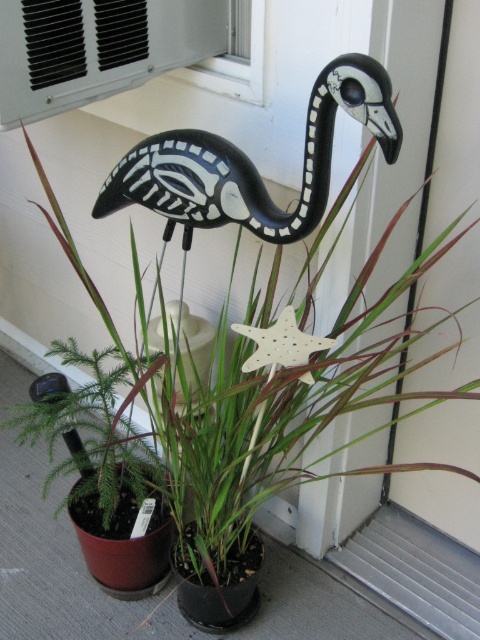
You are standing in the scene and want to place a small statue between the two points, point (105, 52) and point (259, 365). Which point should the statue be closer to in order to be closer to the flamingo?

The statue should be closer to point (259, 365) because it is farther from the viewer than point (105, 52), so placing it near that point would position it closer to the flamingo.

You are a window cleaner standing on a ladder. You need to clean both the black matte plastic bird at upper center and the white plastic air conditioner at upper center. Which object should you clean first if you want to start with the taller one?

The black matte plastic bird at upper center is larger in size compared to the white plastic air conditioner at upper center, so you should clean the black matte plastic bird at upper center first.

Based on the photo, you are a painter standing in front of the scene. You want to paint the white plastic air conditioner at upper center and the white matte star at center. Which object should you paint first if you want to paint the taller one first?

The white plastic air conditioner at upper center is much taller than the white matte star at center, so you should paint the white plastic air conditioner at upper center first.